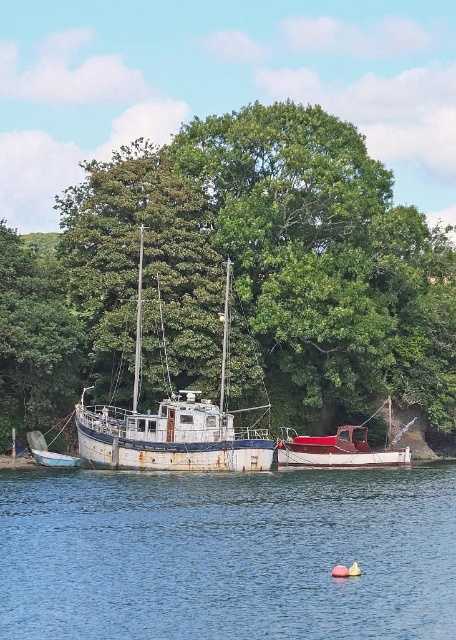
You are a marine biologist studying boat locations in the waterfront scene. You need to determine the exact coordinates of the rustic wood boat at center. What are its coordinates?

The rustic wood boat at center is located at coordinates point [340,449].

You are standing on the dock and want to throw a ball to your friend who is on the rusty metal boat at center. The ball you have can travel up to 10 meters. Will you be able to reach them if you aim for the blue water at center?

The distance between the blue water at center and the rusty metal boat at center is 9.61 meters. Since the ball can travel up to 10 meters, you will be able to reach your friend on the rusty metal boat at center.

You are a photographer standing at the edge of the waterfront. You want to capture a photo of the rusty metal boat at center without any obstructions. Is the green leafy tree at center blocking your view of the boat?

The green leafy tree at center is positioned over the rusty metal boat at center, so it is blocking the view of the boat. You will need to move to a different angle or position to capture an unobstructed photo of the rusty metal boat at center.